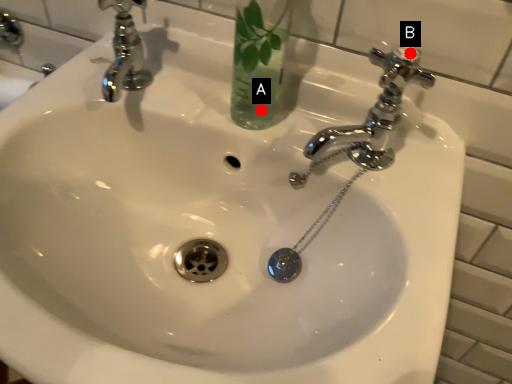
Question: Two points are circled on the image, labeled by A and B beside each circle. Which of the following is the closest to the observer?

Choices:
 (A) A is closer
 (B) B is closer

Answer: (B)